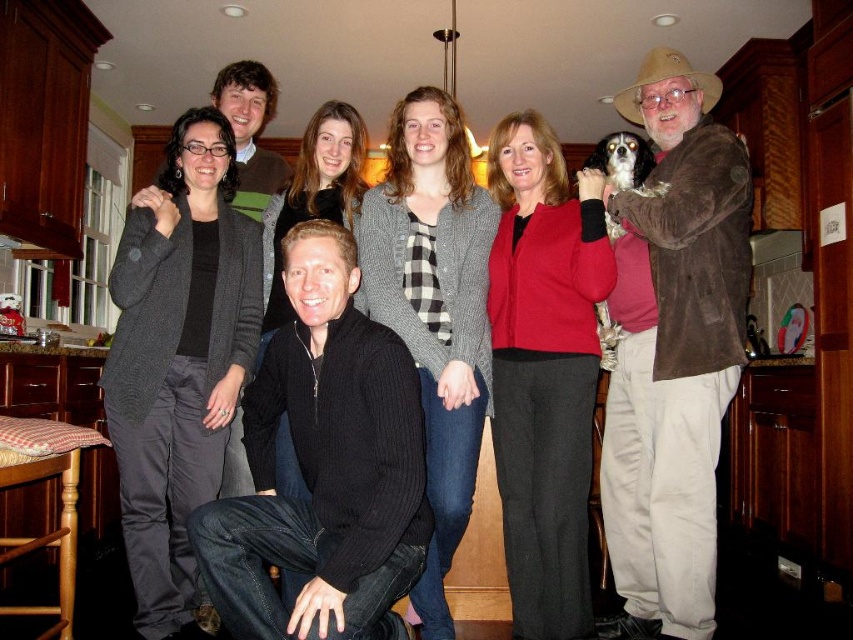
Question: Does dark gray cardigan at center have a larger size compared to gray cardigan at center?

Choices:
 (A) yes
 (B) no

Answer: (B)

Question: Which object appears closest to the camera in this image?

Choices:
 (A) gray cardigan at center
 (B) brown suede jacket at upper right

Answer: (A)

Question: Is red wool sweater at center bigger than gray cardigan at center?

Choices:
 (A) yes
 (B) no

Answer: (B)

Question: Among these objects, which one is farthest from the camera?

Choices:
 (A) matte black sweater at center
 (B) red wool sweater at center
 (C) black ribbed sweater at lower center

Answer: (A)

Question: Which object is positioned farthest from the matte black sweater at center?

Choices:
 (A) gray cardigan at center
 (B) red wool sweater at center
 (C) black ribbed sweater at lower center

Answer: (C)

Question: Can you confirm if matte black sweater at center is positioned above brown suede jacket at upper right?

Choices:
 (A) yes
 (B) no

Answer: (A)